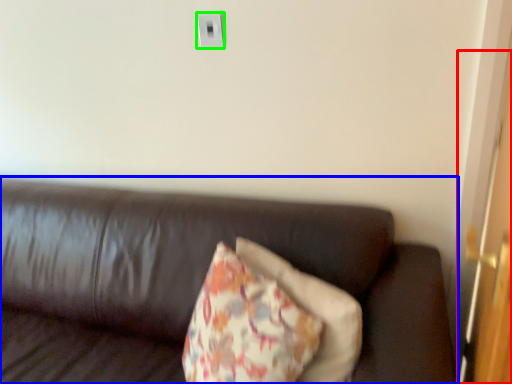
Question: Which object is positioned farthest from door (highlighted by a red box)? Select from studio couch (highlighted by a blue box) and electric outlet (highlighted by a green box).

Choices:
 (A) studio couch
 (B) electric outlet

Answer: (B)